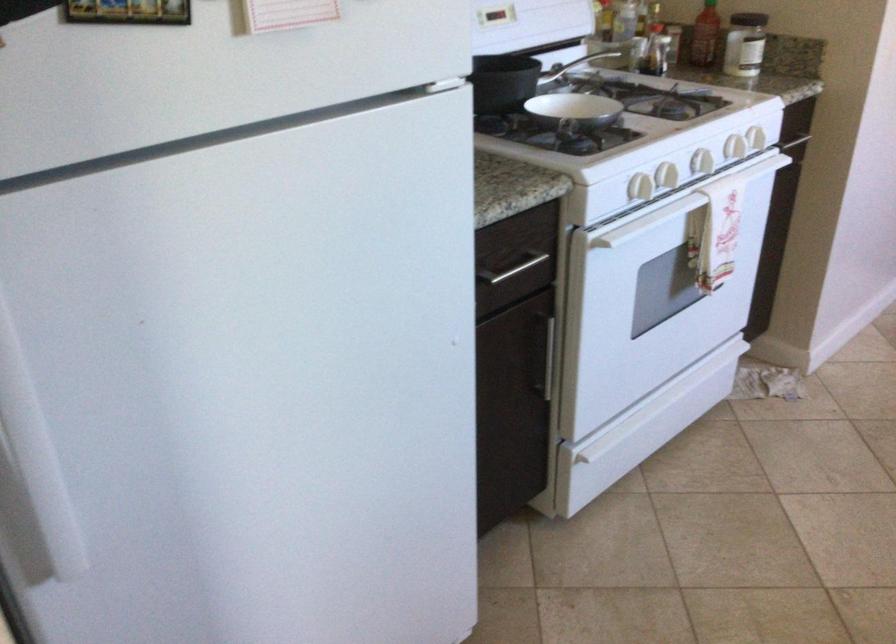
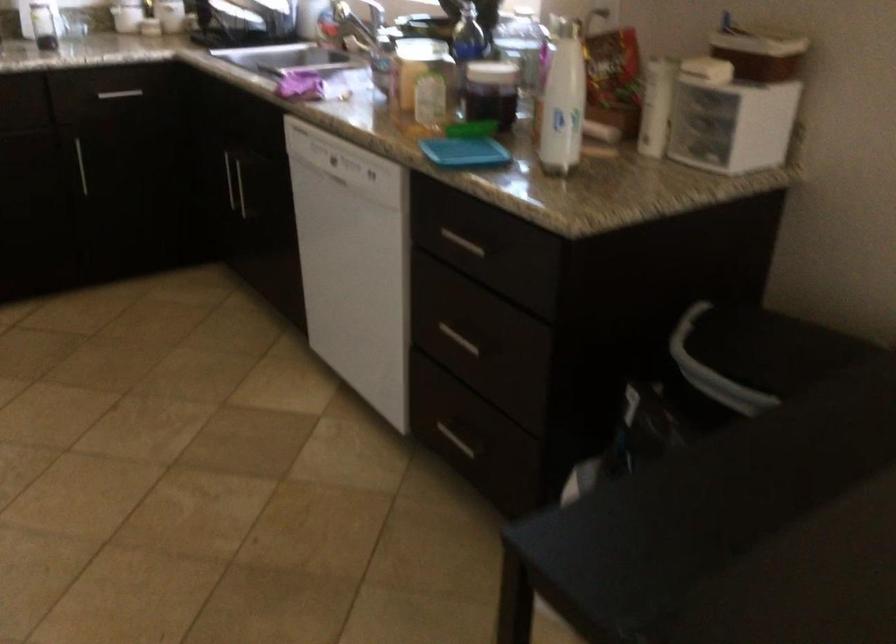
The images are taken continuously from a first-person perspective. In which direction is your viewpoint rotating?

The rotation direction of the camera is right-down.